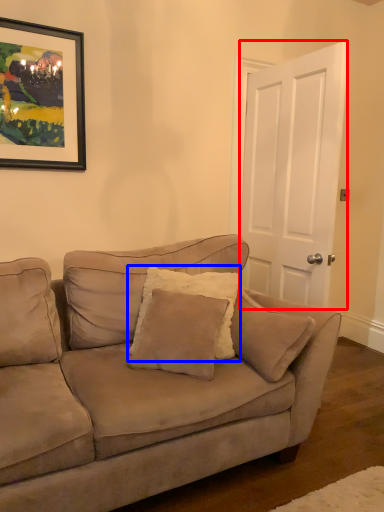
Question: Which point is further to the camera, door (highlighted by a red box) or pillow (highlighted by a blue box)?

Choices:
 (A) door
 (B) pillow

Answer: (A)